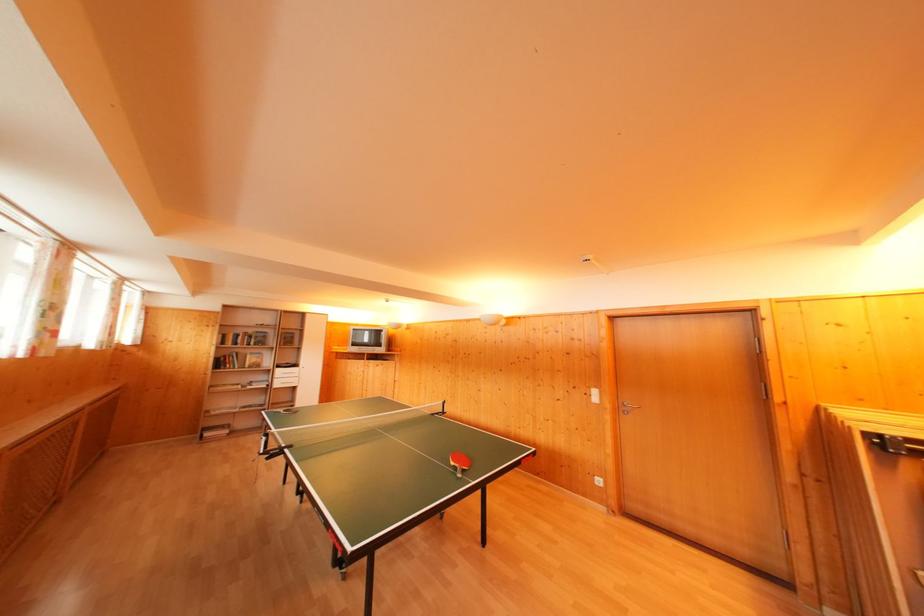
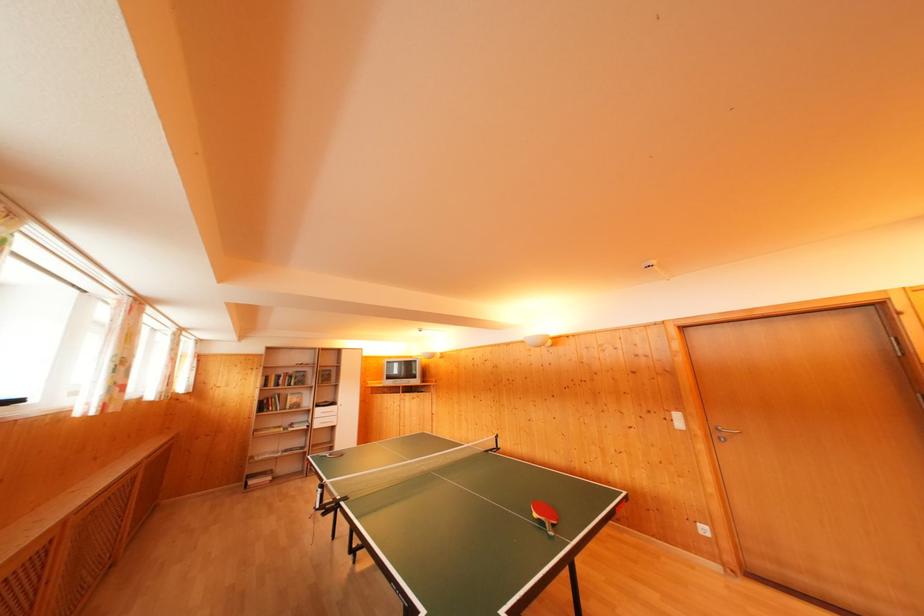
In the second image, find the point that corresponds to point 245,336 in the first image.

(286, 377)